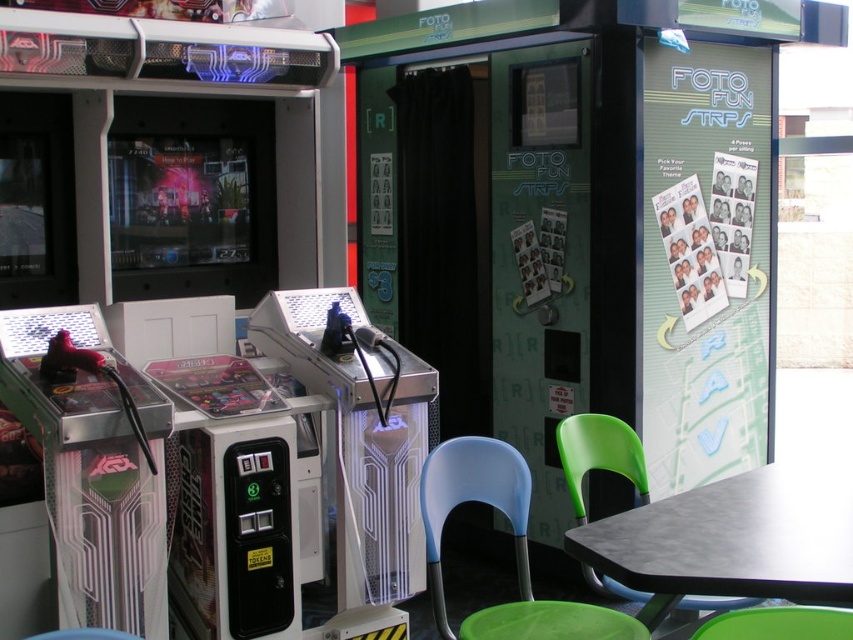
You are a photographer carrying a camera bag that is 1.5 meters long. You are standing in the arcade and want to place your bag on the black matte table at lower right. Can you determine if your bag will fit on the table?

The black matte table at lower right is 1.89 meters from viewer, so the distance is not related to the length of the camera bag. The bag is 1.5 meters long, but the table dimensions are not provided. Therefore, it is unclear if the bag will fit on the table.

You are standing at the entrance of the arcade and want to sit down to rest. The blue plastic chair at lower center is your only option. Can you reach the chair without moving any other objects?

The blue plastic chair at lower center is located at point (x=514, y=547), so yes, you can reach it without moving other objects as its position is fixed in the scene.

You are a customer standing at the entrance of the arcade and want to sit down to rest. You see the black matte table at lower right and the blue plastic chair at lower center. Which object should you approach first if you want to sit?

You should approach the blue plastic chair at lower center first because the black matte table at lower right is located above it, meaning the chair is closer to your current position.